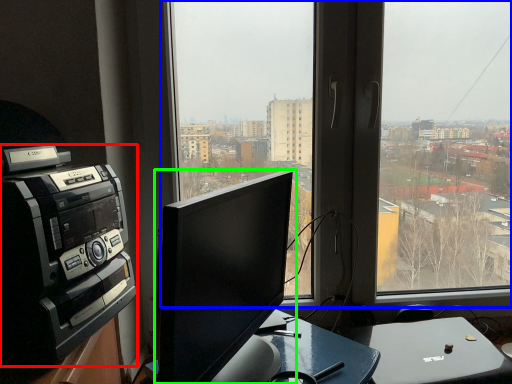
Question: Considering the real-world distances, which object is closest to amplifier (highlighted by a red box)? window (highlighted by a blue box) or computer monitor (highlighted by a green box).

Choices:
 (A) window
 (B) computer monitor

Answer: (B)